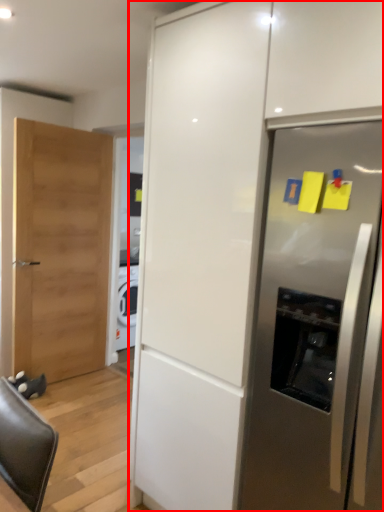
Question: From the image, what is the correct spatial relationship of cabinetry (annotated by the red box) in relation to refrigerator?

Choices:
 (A) right
 (B) left

Answer: (B)